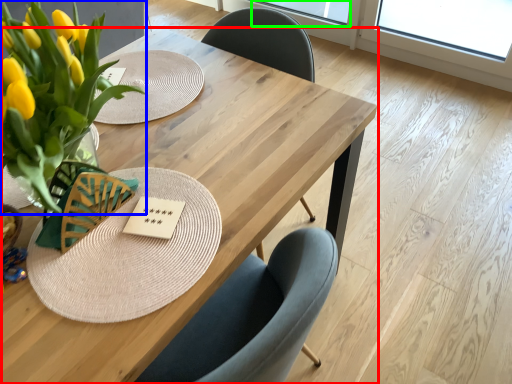
Question: Based on their relative distances, which object is nearer to table (highlighted by a red box)? Choose from floral arrangement (highlighted by a blue box) and window screen (highlighted by a green box).

Choices:
 (A) floral arrangement
 (B) window screen

Answer: (A)